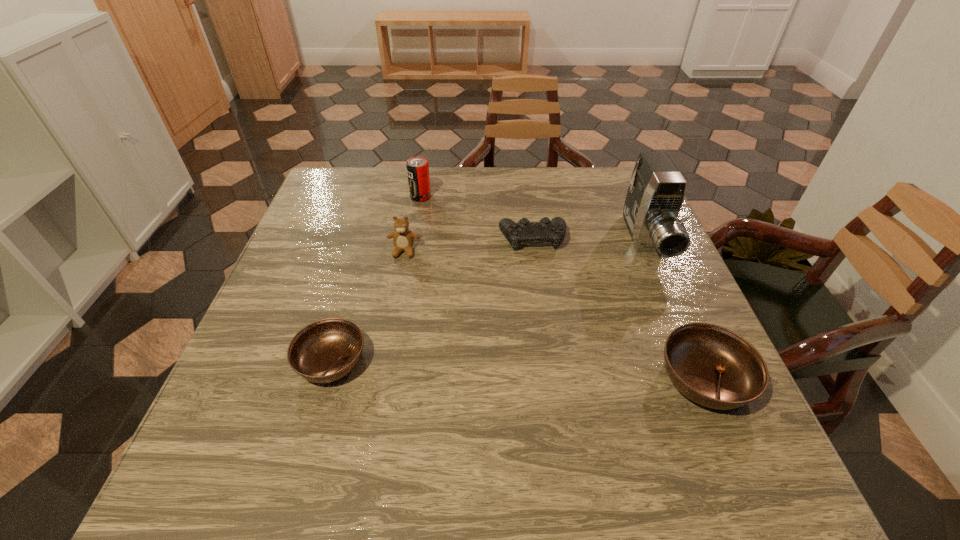
To achieve uniform spacing by inserting another soup_bowl among them, please point to a free space for this new soup_bowl. Please provide its 2D coordinates. Your answer should be formatted as a tuple, i.e. [(x, y)], where the tuple contains the x and y coordinates of a point satisfying the conditions above.

[(515, 369)]